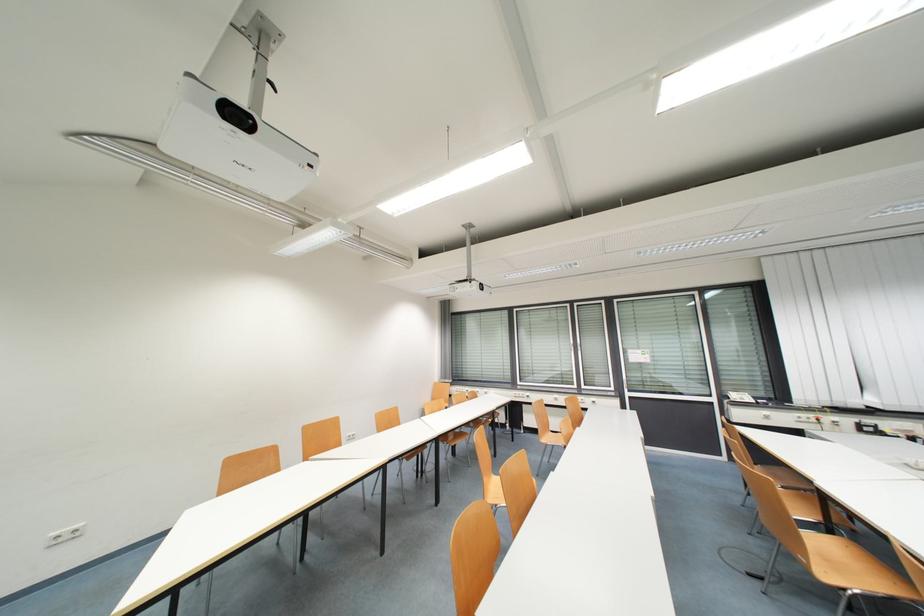
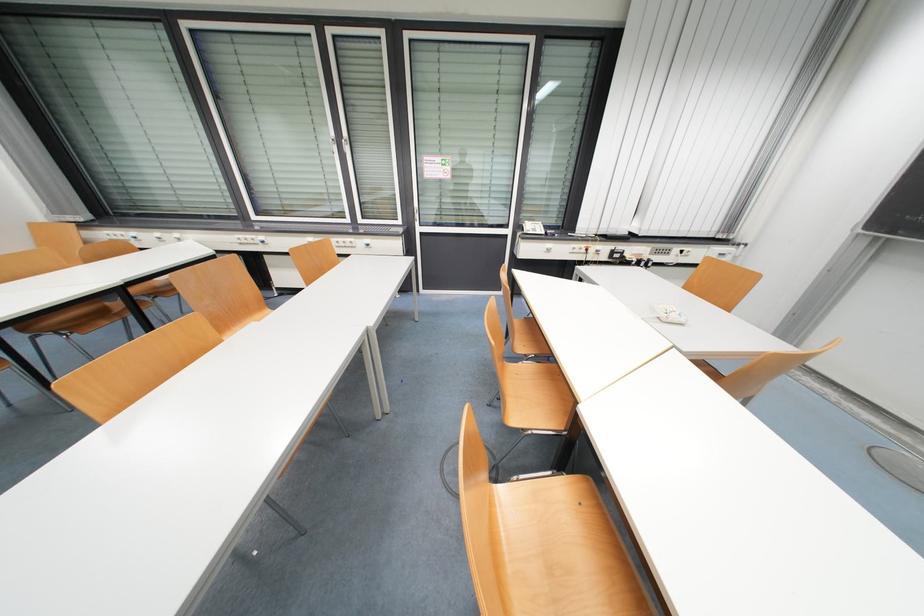
The point at (816, 416) is marked in the first image. Where is the corresponding point in the second image?

(589, 246)